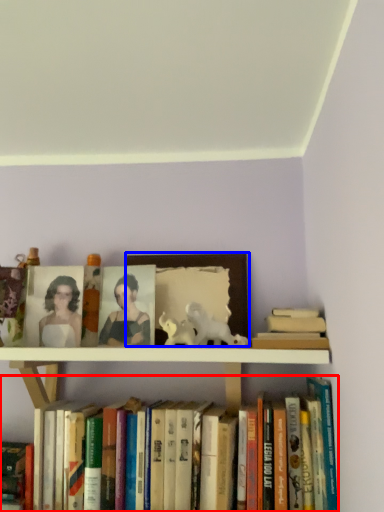
Question: Which of the following is the farthest to the observer, book (highlighted by a red box) or picture frame (highlighted by a blue box)?

Choices:
 (A) book
 (B) picture frame

Answer: (B)